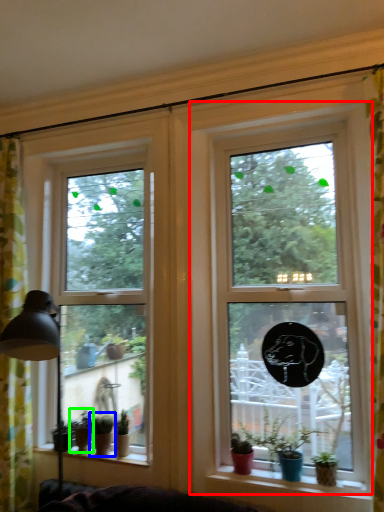
Question: Which object is the farthest from window (highlighted by a red box)? Choose among these: houseplant (highlighted by a blue box) or houseplant (highlighted by a green box).

Choices:
 (A) houseplant
 (B) houseplant

Answer: (B)